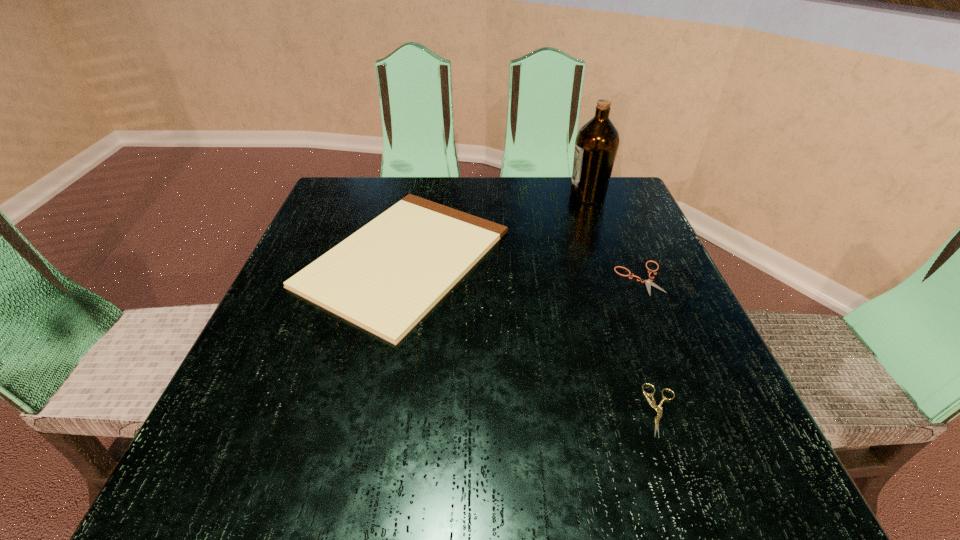
Image resolution: width=960 pixels, height=540 pixels. I want to click on vacant space that satisfies the following two spatial constraints: 1. on the label of the farther shears; 2. on the right side of the tallest object, so click(x=617, y=278).